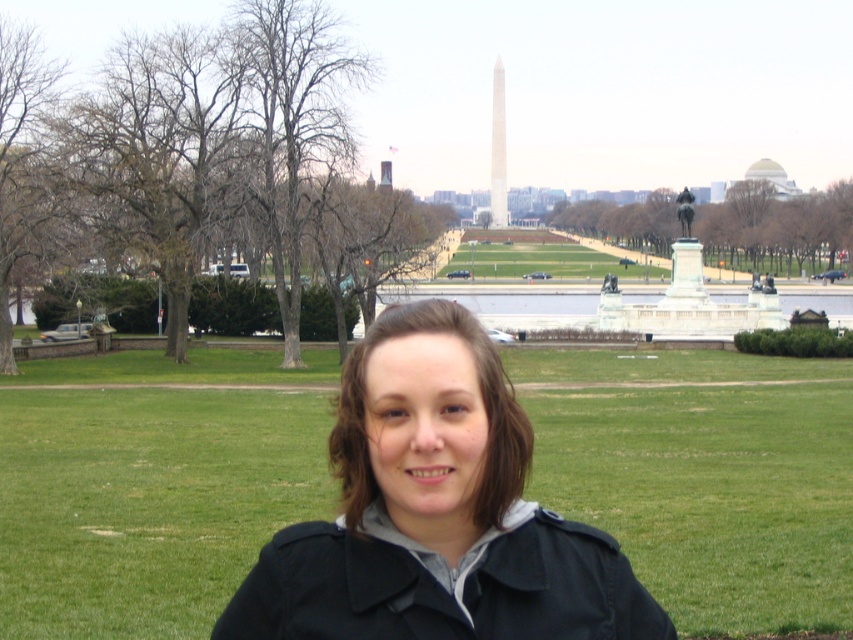
Is black matte jacket at center further to camera compared to bronze statue at center?

No.

The width and height of the screenshot is (853, 640). Describe the element at coordinates (436, 513) in the screenshot. I see `black matte jacket at center` at that location.

I want to click on black matte jacket at center, so click(436, 513).